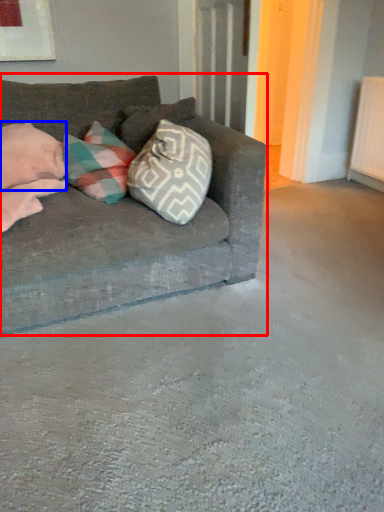
Question: Which point is further to the camera, studio couch (highlighted by a red box) or pillow (highlighted by a blue box)?

Choices:
 (A) studio couch
 (B) pillow

Answer: (B)